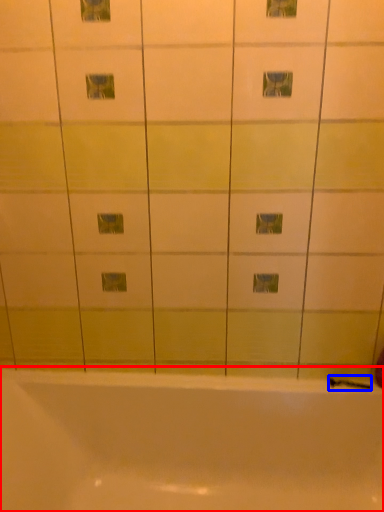
Question: Which object appears farthest to the camera in this image, bathtub (highlighted by a red box) or shower (highlighted by a blue box)?

Choices:
 (A) bathtub
 (B) shower

Answer: (B)